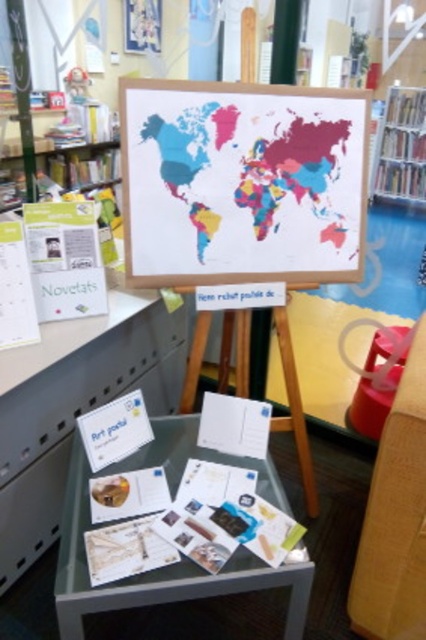
Question: Among these points, which one is nearest to the camera?

Choices:
 (A) click(37, 390)
 (B) click(414, 408)

Answer: (B)

Question: Among these objects, which one is farthest from the camera?

Choices:
 (A) smooth plastic chair at lower right
 (B) colorful paper map at center

Answer: (B)

Question: Can you confirm if clear glass table at center is bigger than smooth plastic chair at lower right?

Choices:
 (A) yes
 (B) no

Answer: (A)

Question: Is colorful paper map at center closer to the viewer compared to matte plastic table at lower center?

Choices:
 (A) no
 (B) yes

Answer: (A)

Question: Does matte plastic table at lower center appear over clear glass table at center?

Choices:
 (A) yes
 (B) no

Answer: (A)

Question: Among these points, which one is farthest from the camera?

Choices:
 (A) (362, 374)
 (B) (416, 195)

Answer: (B)